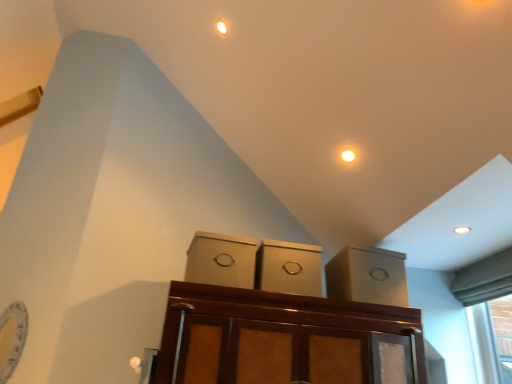
Describe the element at coordinates (221, 260) in the screenshot. I see `matte cardboard box at center, the 3th cabinetry viewed from the right` at that location.

This screenshot has width=512, height=384. What are the coordinates of `matte cardboard box at center, which is counted as the first cabinetry, starting from the right` in the screenshot? It's located at (368, 276).

From the image's perspective, relative to matte cardboard box at center, which is counted as the first cabinetry, starting from the right, is matte cardboard boxes at center, arranged as the 2th cabinetry when viewed from the left, above or below?

Based on their image positions, matte cardboard boxes at center, arranged as the 2th cabinetry when viewed from the left, is located above matte cardboard box at center, which is counted as the first cabinetry, starting from the right.

How many degrees apart are the facing directions of matte cardboard boxes at center, arranged as the 2th cabinetry when viewed from the left, and matte cardboard box at center, which is counted as the first cabinetry, starting from the right?

3.89 degrees separate the facing orientations of matte cardboard boxes at center, arranged as the 2th cabinetry when viewed from the left, and matte cardboard box at center, which is counted as the first cabinetry, starting from the right.

Is matte cardboard boxes at center, arranged as the 2th cabinetry when viewed from the left, inside the boundaries of matte cardboard box at center, which is counted as the first cabinetry, starting from the right, or outside?

matte cardboard boxes at center, arranged as the 2th cabinetry when viewed from the left, is spatially situated outside matte cardboard box at center, which is counted as the first cabinetry, starting from the right.

From a real-world perspective, is matte cardboard boxes at center, arranged as the 2th cabinetry when viewed from the left, located beneath matte cardboard box at center, which is counted as the first cabinetry, starting from the right?

Indeed, from a real-world perspective, matte cardboard boxes at center, arranged as the 2th cabinetry when viewed from the left, is positioned beneath matte cardboard box at center, which is counted as the first cabinetry, starting from the right.

Is matte cardboard boxes at center, the second cabinetry in the right-to-left sequence, oriented away from matte cardboard box at center, acting as the first cabinetry starting from the left?

No, matte cardboard box at center, acting as the first cabinetry starting from the left, is not at the back of matte cardboard boxes at center, the second cabinetry in the right-to-left sequence.

Is matte cardboard boxes at center, the second cabinetry in the right-to-left sequence, inside or outside of matte cardboard box at center, the 3th cabinetry viewed from the right?

The correct answer is: outside.

From the image's perspective, would you say matte cardboard boxes at center, arranged as the 2th cabinetry when viewed from the left, is shown under matte cardboard box at center, the 3th cabinetry viewed from the right?

Correct, matte cardboard boxes at center, arranged as the 2th cabinetry when viewed from the left, appears lower than matte cardboard box at center, the 3th cabinetry viewed from the right, in the image.

From a real-world perspective, is matte cardboard boxes at center, arranged as the 2th cabinetry when viewed from the left, located beneath matte cardboard box at center, acting as the first cabinetry starting from the left?

Yes, from a real-world perspective, matte cardboard boxes at center, arranged as the 2th cabinetry when viewed from the left, is below matte cardboard box at center, acting as the first cabinetry starting from the left.

Who is taller, matte cardboard box at center, acting as the first cabinetry starting from the left, or matte cardboard boxes at center, the second cabinetry in the right-to-left sequence?

matte cardboard boxes at center, the second cabinetry in the right-to-left sequence.

What are the coordinates of `the 1st cabinetry above the matte cardboard boxes at center, the second cabinetry in the right-to-left sequence (from a real-world perspective)` in the screenshot? It's located at (221, 260).

Would you consider matte cardboard box at center, the 3th cabinetry viewed from the right, to be distant from matte cardboard boxes at center, arranged as the 2th cabinetry when viewed from the left?

They are positioned close to each other.

Would you say matte cardboard boxes at center, arranged as the 2th cabinetry when viewed from the left, is part of matte cardboard box at center, acting as the first cabinetry starting from the left,'s contents?

Actually, matte cardboard boxes at center, arranged as the 2th cabinetry when viewed from the left, is outside matte cardboard box at center, acting as the first cabinetry starting from the left.

Which of these two, matte cardboard box at center, acting as the first cabinetry starting from the left, or matte cardboard box at center, which is counted as the first cabinetry, starting from the right, is smaller?

matte cardboard box at center, acting as the first cabinetry starting from the left, is smaller.

What's the angular difference between matte cardboard box at center, acting as the first cabinetry starting from the left, and matte cardboard box at center, acting as the third cabinetry starting from the left,'s facing directions?

matte cardboard box at center, acting as the first cabinetry starting from the left, and matte cardboard box at center, acting as the third cabinetry starting from the left, are facing 0.082 degrees away from each other.

Does matte cardboard box at center, the 3th cabinetry viewed from the right, have a greater width compared to matte cardboard box at center, acting as the third cabinetry starting from the left?

Incorrect, the width of matte cardboard box at center, the 3th cabinetry viewed from the right, does not surpass that of matte cardboard box at center, acting as the third cabinetry starting from the left.

Does matte cardboard box at center, acting as the first cabinetry starting from the left, lie in front of matte cardboard box at center, acting as the third cabinetry starting from the left?

Yes, it is.

In order to click on the 2nd cabinetry behind the matte cardboard box at center, the 3th cabinetry viewed from the right in this screenshot , I will do `click(368, 276)`.

Is matte cardboard box at center, acting as the third cabinetry starting from the left, completely or partially outside of matte cardboard box at center, acting as the first cabinetry starting from the left?

matte cardboard box at center, acting as the third cabinetry starting from the left, lies outside matte cardboard box at center, acting as the first cabinetry starting from the left,'s area.

From the image's perspective, is matte cardboard box at center, which is counted as the first cabinetry, starting from the right, positioned above or below matte cardboard box at center, acting as the first cabinetry starting from the left?

Clearly, from the image's perspective, matte cardboard box at center, which is counted as the first cabinetry, starting from the right, is below matte cardboard box at center, acting as the first cabinetry starting from the left.

Looking at the image, does matte cardboard box at center, which is counted as the first cabinetry, starting from the right, seem bigger or smaller compared to matte cardboard boxes at center, arranged as the 2th cabinetry when viewed from the left?

In the image, matte cardboard box at center, which is counted as the first cabinetry, starting from the right, appears to be larger than matte cardboard boxes at center, arranged as the 2th cabinetry when viewed from the left.

From the image's perspective, does matte cardboard box at center, which is counted as the first cabinetry, starting from the right, appear lower than matte cardboard boxes at center, arranged as the 2th cabinetry when viewed from the left?

Yes, from the image's perspective, matte cardboard box at center, which is counted as the first cabinetry, starting from the right, is beneath matte cardboard boxes at center, arranged as the 2th cabinetry when viewed from the left.

Identify the location of cabinetry that is the 1st one when counting forward from the matte cardboard box at center, acting as the third cabinetry starting from the left. (289, 268).

There is a matte cardboard box at center, acting as the third cabinetry starting from the left. Identify the location of the 1st cabinetry above it (from the image's perspective). (289, 268).

Find the location of a particular element. This screenshot has width=512, height=384. cabinetry on the left of matte cardboard boxes at center, arranged as the 2th cabinetry when viewed from the left is located at coordinates (221, 260).

Looking at this image, considering their positions, is matte cardboard box at center, the 3th cabinetry viewed from the right, positioned closer to matte cardboard boxes at center, arranged as the 2th cabinetry when viewed from the left, than matte cardboard box at center, acting as the third cabinetry starting from the left?

matte cardboard box at center, the 3th cabinetry viewed from the right, is positioned closer to the anchor matte cardboard boxes at center, arranged as the 2th cabinetry when viewed from the left.

Looking at the image, which one is located further to matte cardboard box at center, acting as the first cabinetry starting from the left, matte cardboard box at center, acting as the third cabinetry starting from the left, or matte cardboard boxes at center, the second cabinetry in the right-to-left sequence?

The object further to matte cardboard box at center, acting as the first cabinetry starting from the left, is matte cardboard box at center, acting as the third cabinetry starting from the left.

From the image, which object appears to be farther from matte cardboard box at center, the 3th cabinetry viewed from the right, matte cardboard boxes at center, arranged as the 2th cabinetry when viewed from the left, or matte cardboard box at center, which is counted as the first cabinetry, starting from the right?

Among the two, matte cardboard box at center, which is counted as the first cabinetry, starting from the right, is located further to matte cardboard box at center, the 3th cabinetry viewed from the right.

Which object lies further to the anchor point matte cardboard boxes at center, arranged as the 2th cabinetry when viewed from the left, matte cardboard box at center, which is counted as the first cabinetry, starting from the right, or matte cardboard box at center, the 3th cabinetry viewed from the right?

matte cardboard box at center, which is counted as the first cabinetry, starting from the right, is further to matte cardboard boxes at center, arranged as the 2th cabinetry when viewed from the left.

Considering their positions, is matte cardboard box at center, the 3th cabinetry viewed from the right, positioned further to matte cardboard box at center, which is counted as the first cabinetry, starting from the right, than matte cardboard boxes at center, the second cabinetry in the right-to-left sequence?

matte cardboard box at center, the 3th cabinetry viewed from the right.

From the image, which object appears to be farther from matte cardboard box at center, which is counted as the first cabinetry, starting from the right, matte cardboard boxes at center, the second cabinetry in the right-to-left sequence, or matte cardboard box at center, the 3th cabinetry viewed from the right?

matte cardboard box at center, the 3th cabinetry viewed from the right.

Where is `cabinetry between matte cardboard box at center, the 3th cabinetry viewed from the right, and matte cardboard box at center, which is counted as the first cabinetry, starting from the right`? cabinetry between matte cardboard box at center, the 3th cabinetry viewed from the right, and matte cardboard box at center, which is counted as the first cabinetry, starting from the right is located at coordinates (289, 268).